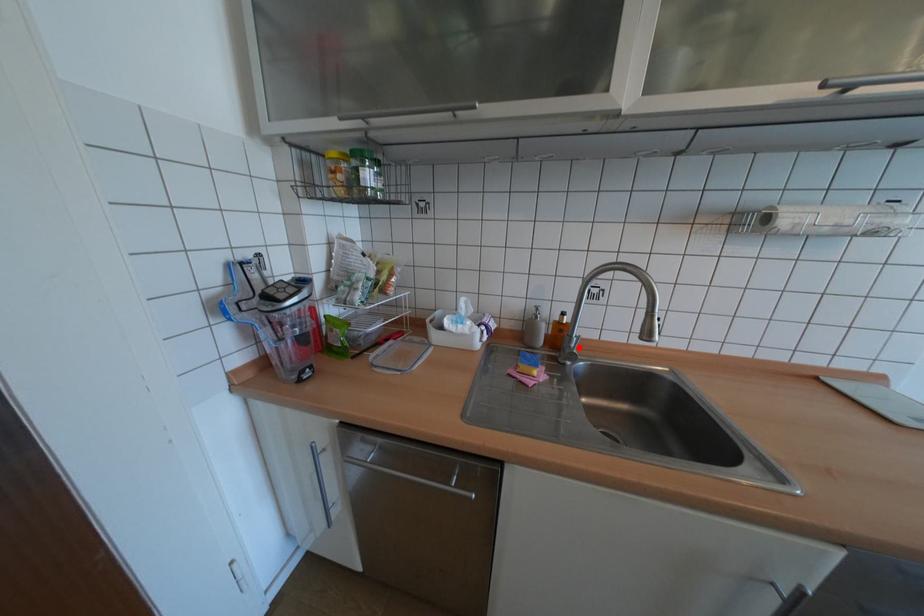
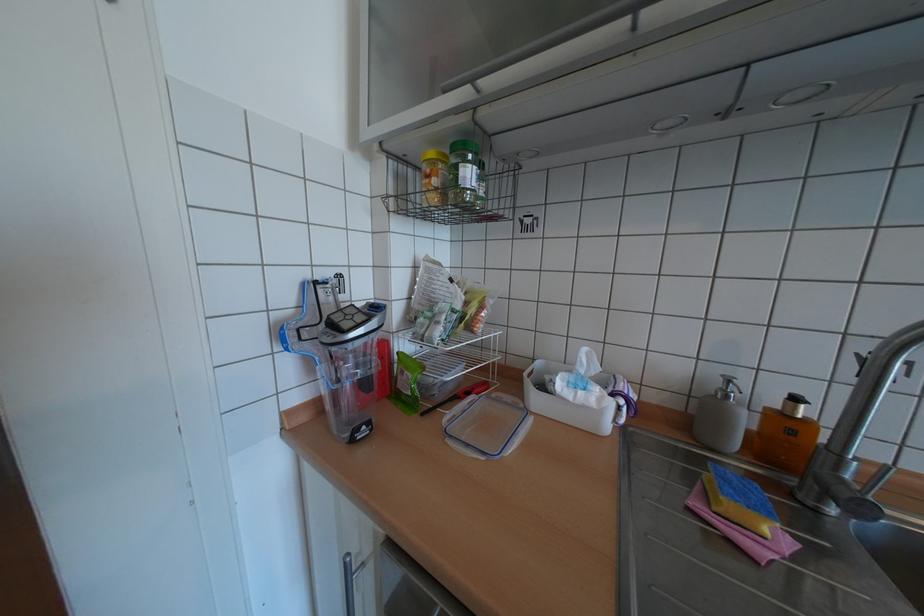
Where in the second image is the point corresponding to the highlighted location from the first image?

(852, 480)